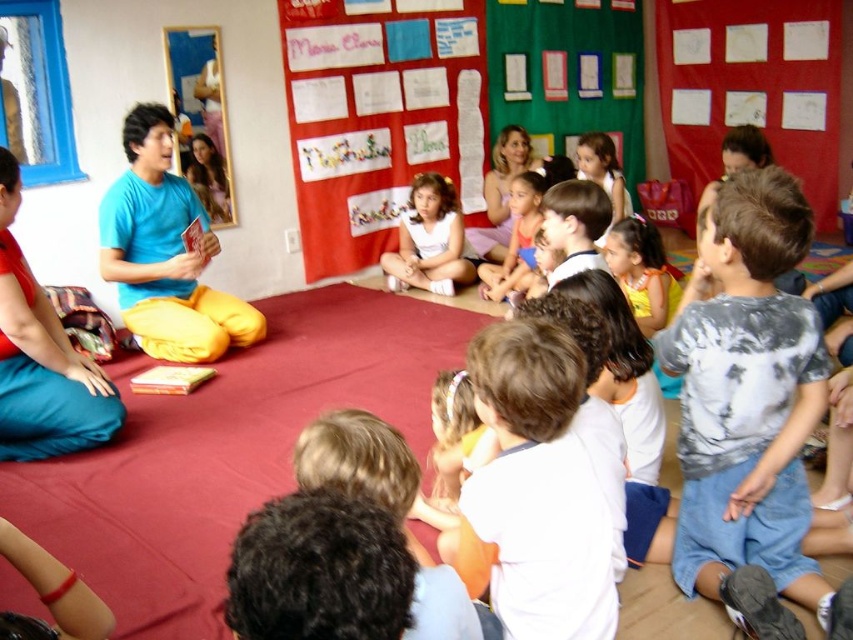
Question: Does gray tie-dye shirt at lower right lie behind white cotton shirt at lower center?

Choices:
 (A) no
 (B) yes

Answer: (B)

Question: Which object is positioned closest to the white matte dress at center?

Choices:
 (A) matte pink dress at center
 (B) gray tie-dye shirt at lower right
 (C) blue cotton shirt at upper left
 (D) white cotton shirt at lower center

Answer: (A)

Question: Is white cotton shirt at lower center to the left of matte blue shirt at center from the viewer's perspective?

Choices:
 (A) no
 (B) yes

Answer: (A)

Question: Among these points, which one is farthest from the camera?

Choices:
 (A) (527, 282)
 (B) (486, 488)

Answer: (A)

Question: Which point appears farthest from the camera in this image?

Choices:
 (A) (488, 504)
 (B) (193, 289)

Answer: (B)

Question: Is blue cotton shirt at upper left in front of matte pink dress at center?

Choices:
 (A) no
 (B) yes

Answer: (B)